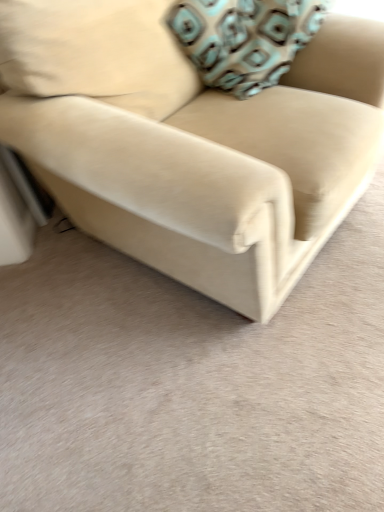
Question: Can you confirm if teal-patterned fabric pillow at upper right is shorter than beige fabric couch at center?

Choices:
 (A) no
 (B) yes

Answer: (B)

Question: From the image's perspective, would you say teal-patterned fabric pillow at upper right is shown under beige fabric couch at center?

Choices:
 (A) no
 (B) yes

Answer: (A)

Question: Is teal-patterned fabric pillow at upper right wider than beige fabric couch at center?

Choices:
 (A) no
 (B) yes

Answer: (A)

Question: From a real-world perspective, is teal-patterned fabric pillow at upper right positioned under beige fabric couch at center based on gravity?

Choices:
 (A) no
 (B) yes

Answer: (A)

Question: Is teal-patterned fabric pillow at upper right facing away from beige fabric couch at center?

Choices:
 (A) yes
 (B) no

Answer: (A)

Question: Is teal-patterned fabric pillow at upper right bigger than beige fabric couch at center?

Choices:
 (A) no
 (B) yes

Answer: (A)

Question: From the image's perspective, is beige fabric couch at center above teal-patterned fabric pillow at upper right?

Choices:
 (A) yes
 (B) no

Answer: (B)

Question: Can you confirm if beige fabric couch at center is smaller than teal-patterned fabric pillow at upper right?

Choices:
 (A) no
 (B) yes

Answer: (A)

Question: Can you confirm if beige fabric couch at center is bigger than teal-patterned fabric pillow at upper right?

Choices:
 (A) yes
 (B) no

Answer: (A)

Question: From a real-world perspective, is beige fabric couch at center beneath teal-patterned fabric pillow at upper right?

Choices:
 (A) yes
 (B) no

Answer: (A)

Question: Can you see beige fabric couch at center touching teal-patterned fabric pillow at upper right?

Choices:
 (A) yes
 (B) no

Answer: (B)

Question: Does beige fabric couch at center come in front of teal-patterned fabric pillow at upper right?

Choices:
 (A) yes
 (B) no

Answer: (A)

Question: From the image's perspective, is beige fabric couch at center located above or below teal-patterned fabric pillow at upper right?

Choices:
 (A) below
 (B) above

Answer: (A)